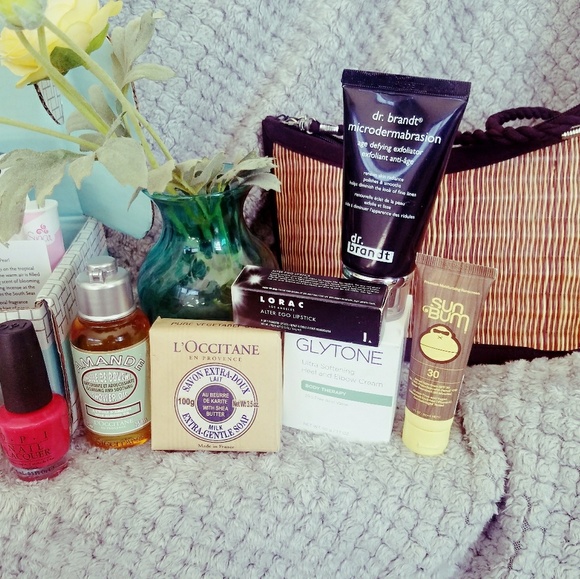
Identify the location of box. (226, 376), (327, 388).